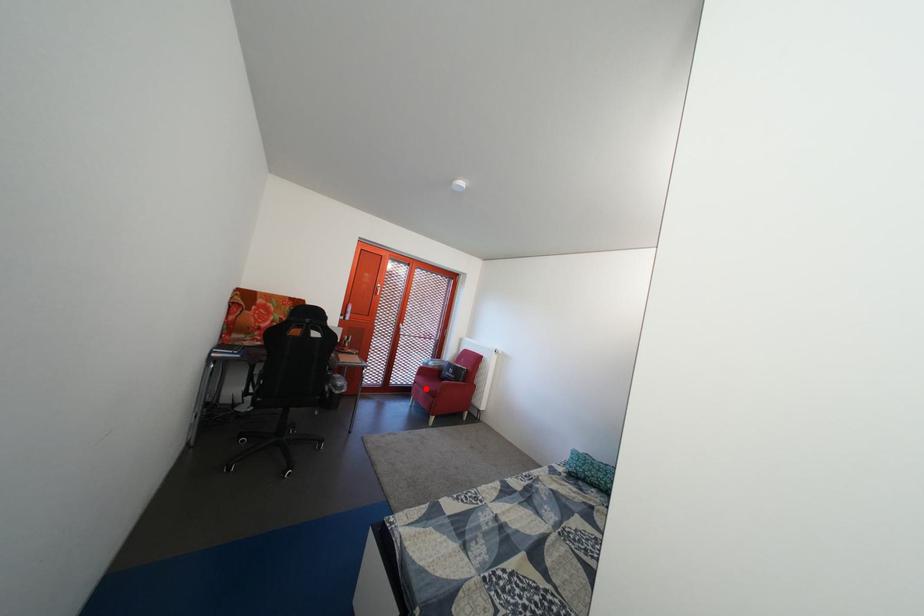
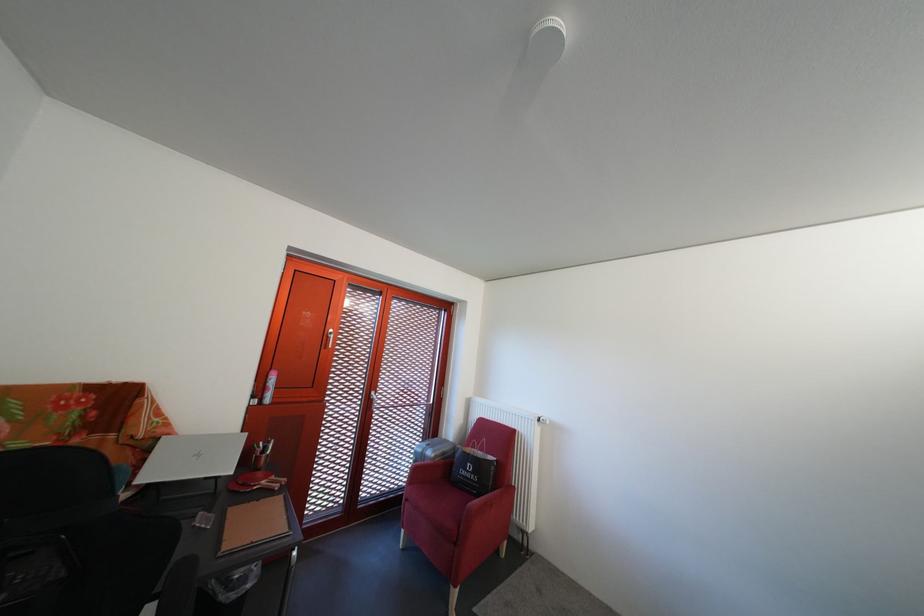
The point at the highlighted location is marked in the first image. Where is the corresponding point in the second image?

(418, 507)